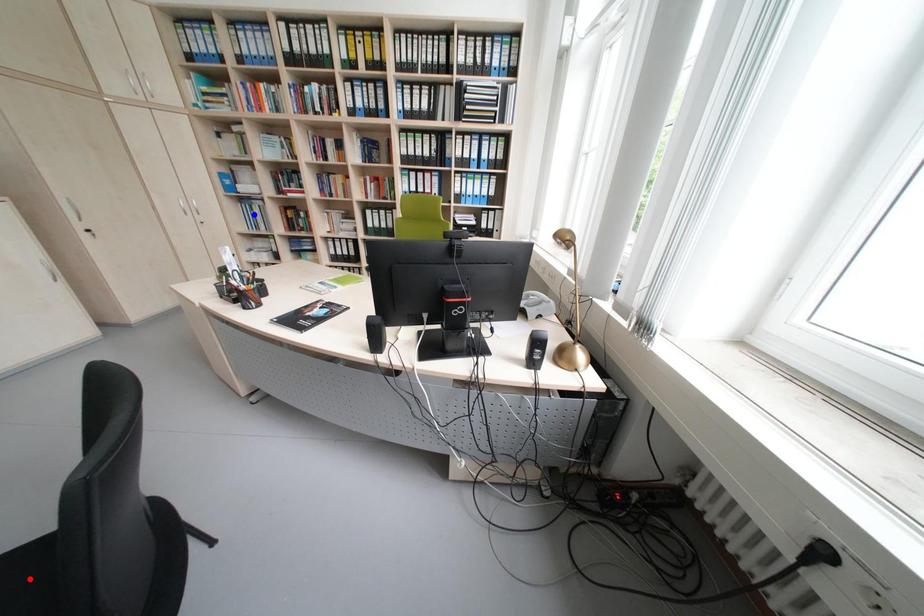
Question: Two points are marked on the image. Which point is closer to the camera?

Choices:
 (A) Blue point is closer.
 (B) Red point is closer.

Answer: (B)